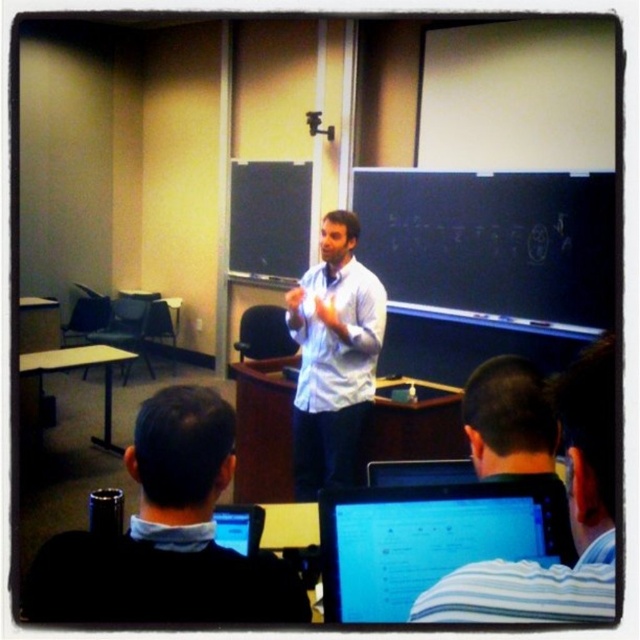
Which is more to the left, black sweater at lower left or striped shirt at center?

black sweater at lower left is more to the left.

Which is in front, point (234, 413) or point (552, 403)?

Point (552, 403)

Who is more forward, [132,524] or [500,570]?

Point [500,570] is more forward.

Find the location of a particular element. This screenshot has height=640, width=640. black sweater at lower left is located at coordinates (166, 534).

Which is more to the right, matte black monitor at lower center or striped shirt at center?

From the viewer's perspective, striped shirt at center appears more on the right side.

From the picture: Does matte black monitor at lower center lie in front of striped shirt at center?

→ No, matte black monitor at lower center is behind striped shirt at center.

Where is `matte black monitor at lower center`? The width and height of the screenshot is (640, 640). matte black monitor at lower center is located at coordinates (429, 538).

Who is more distant from viewer, (266,557) or (394,531)?

The point (394,531) is behind.

Which is behind, point (132, 561) or point (340, 605)?

Point (340, 605)

Locate an element on the screen. Image resolution: width=640 pixels, height=640 pixels. black sweater at lower left is located at coordinates (166, 534).